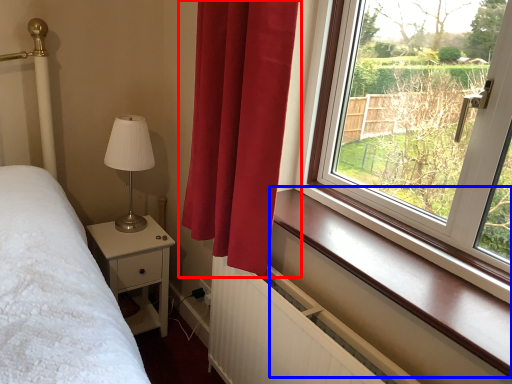
Question: Which of the following is the closest to the observer, curtain (highlighted by a red box) or window sill (highlighted by a blue box)?

Choices:
 (A) curtain
 (B) window sill

Answer: (B)